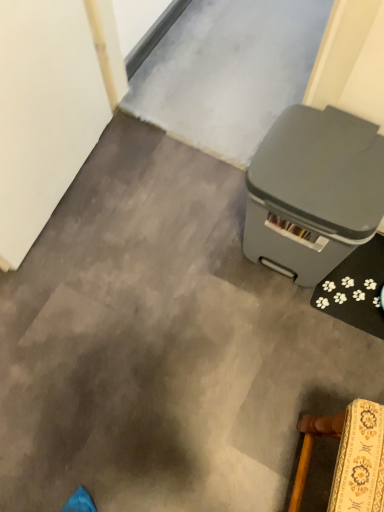
At what (x,y) coordinates should I click in order to perform the action: click on vacant space in front of gray plastic waste bin at right. Please return your answer as a coordinate pair (x, y). Image resolution: width=384 pixels, height=512 pixels. Looking at the image, I should click on (294, 331).